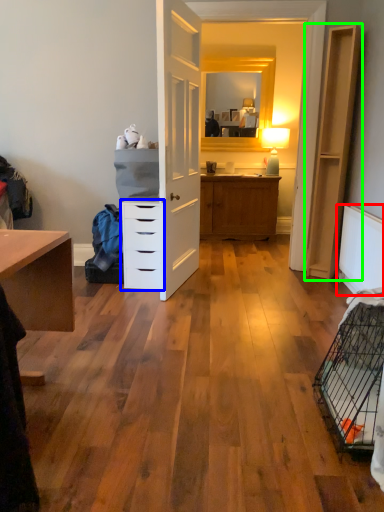
Question: Estimate the real-world distances between objects in this image. Which object is farther from radiator (highlighted by a red box), chest of drawers (highlighted by a blue box) or file cabinet (highlighted by a green box)?

Choices:
 (A) chest of drawers
 (B) file cabinet

Answer: (A)